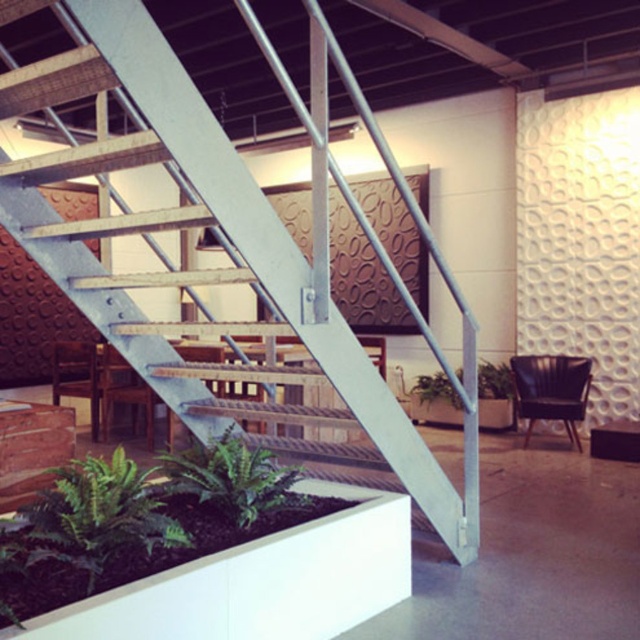
You are a delivery person carrying a package that requires a clear path between the green leafy plant at lower left and the green leafy plant at center. The package is 5 meters long. Can you safely move the package through the space between them?

The distance between the green leafy plant at lower left and green leafy plant at center is 4.97 meters. Since the package is 5 meters long, it is slightly too long to fit through the space. You should find an alternative route or repackage the item to a shorter length.

Based on the photo, you are standing at the entrance of the room and want to sit down. There is a metallic staircase at center and a black leather chair at right. Which object is closer to your right side?

The black leather chair at right is closer to your right side because it is positioned to the right of the metallic staircase at center.

Based on the photo, you are an interior designer assessing the space. You need to place a new sofa that is the same size as the black leather chair at right. Where could you place it without blocking the metallic staircase at center?

Since the metallic staircase at center is bigger than the black leather chair at right, you could place the new sofa in areas away from the staircase, such as near the white planter box in the foreground or against the wall opposite the staircase, ensuring it doesn not obstruct the staircase.